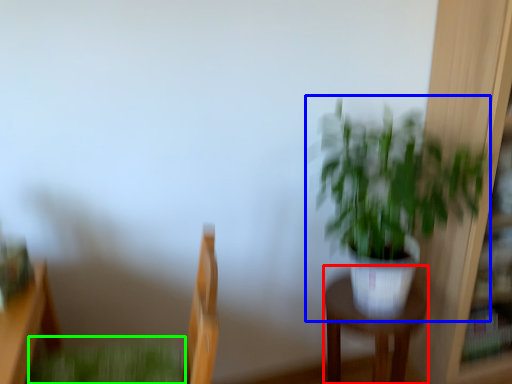
Question: Which is nearer to the furniture (highlighted by a red box)? houseplant (highlighted by a blue box) or plant (highlighted by a green box).

Choices:
 (A) houseplant
 (B) plant

Answer: (A)